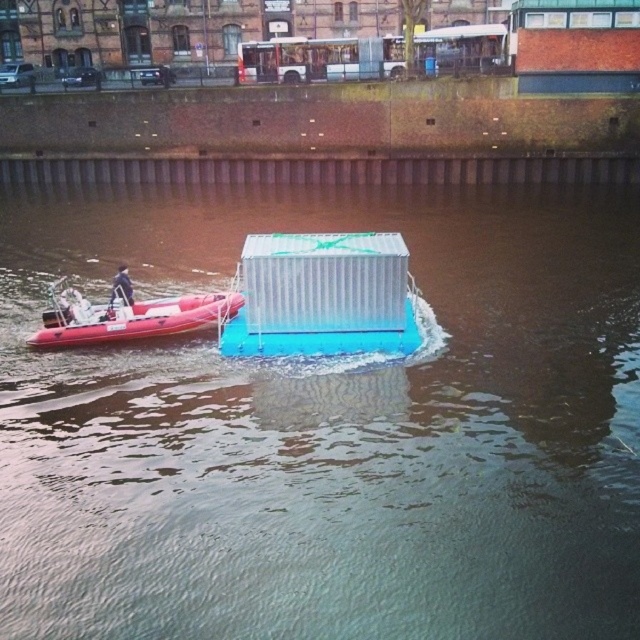
You are standing at point A located at coordinates (328, 428) in the scene. What object is directly in front of you?

The metallic blue container at center is directly in front of you at point (328, 428).

You are navigating a small boat on the river and need to determine the correct path between two points. The first point is at coordinates point (572, 196) and the second is at point (106, 310). Based on the scene description, which point is closer to the brick wall lining the riverbank?

Point (106, 310) is closer to the brick wall lining the riverbank because it is in front of point (572, 196), which is behind it according to the description.